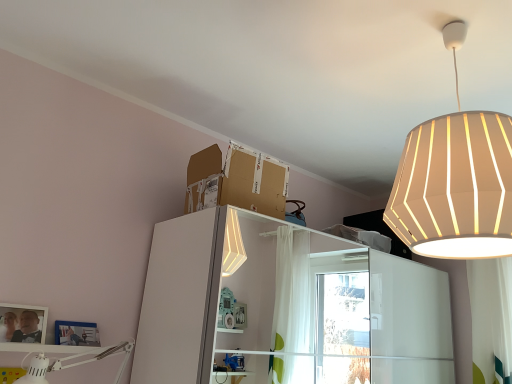
Question: From their relative heights in the image, would you say white glossy bookshelf at upper center is taller or shorter than brown cardboard box at upper center?

Choices:
 (A) tall
 (B) short

Answer: (A)

Question: From the image's perspective, is white glossy bookshelf at upper center above or below brown cardboard box at upper center?

Choices:
 (A) above
 (B) below

Answer: (B)

Question: Which object is the farthest from the brown cardboard box at upper center?

Choices:
 (A) white fabric curtain at right
 (B) white fabric lampshade at upper right, positioned as the first lamp in top-to-bottom order
 (C) white glossy bookshelf at upper center
 (D) matte silver picture frame at lower left
 (E) white matte desk lamp at lower left, which is counted as the second lamp, starting from the right

Answer: (C)

Question: Estimate the real-world distances between objects in this image. Which object is closer to the white fabric curtain at right?

Choices:
 (A) matte silver picture frame at lower left
 (B) brown cardboard box at upper center
 (C) white fabric lampshade at upper right, positioned as the first lamp in top-to-bottom order
 (D) white glossy bookshelf at upper center
 (E) white matte desk lamp at lower left, which is counted as the second lamp, starting from the right

Answer: (D)